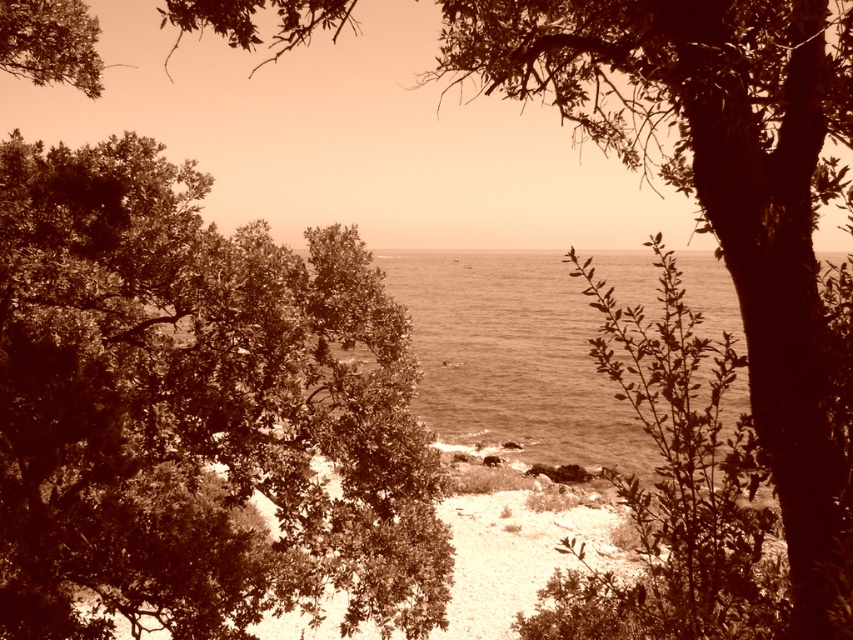
Question: Among these objects, which one is nearest to the camera?

Choices:
 (A) green leafy tree at center
 (B) sepia water at center

Answer: (A)

Question: Which point is closer to the camera taking this photo?

Choices:
 (A) (85, 276)
 (B) (502, 269)

Answer: (A)

Question: Is green leafy tree at center above sepia water at center?

Choices:
 (A) no
 (B) yes

Answer: (A)

Question: Is green leafy tree at center above sepia water at center?

Choices:
 (A) no
 (B) yes

Answer: (A)

Question: Does green leafy tree at center have a greater width compared to sepia water at center?

Choices:
 (A) no
 (B) yes

Answer: (A)